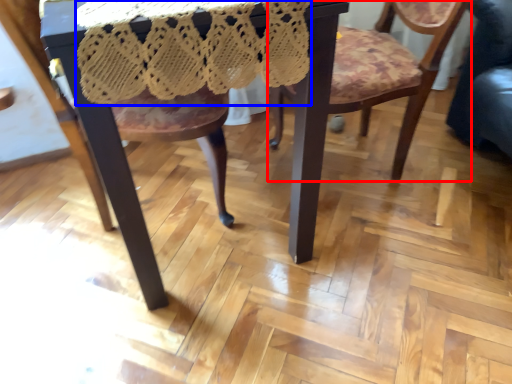
Question: Which point is closer to the camera, chair (highlighted by a red box) or lace dress (highlighted by a blue box)?

Choices:
 (A) chair
 (B) lace dress

Answer: (B)